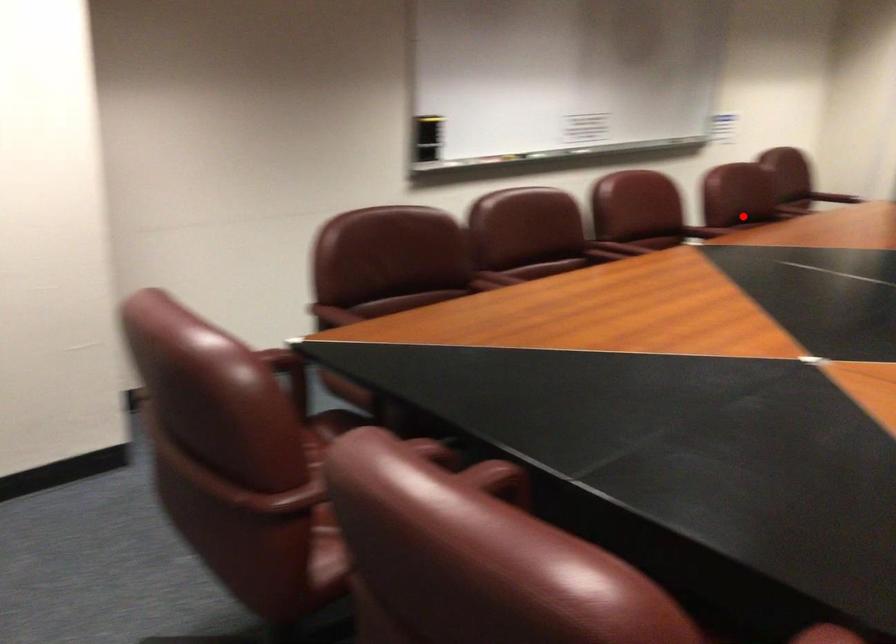
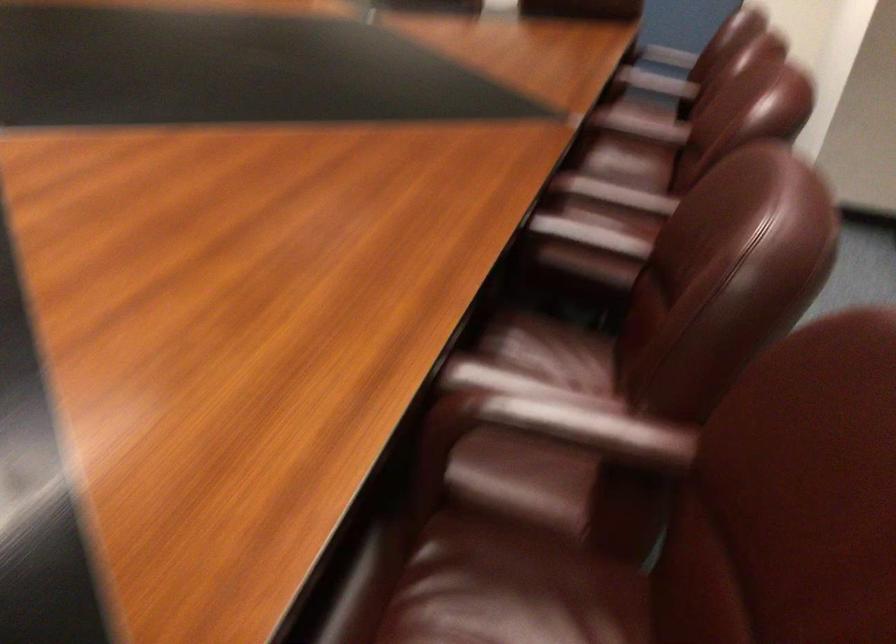
Question: I am providing you with two images of the same scene from different viewpoints. In image1, a red point is highlighted. Considering the same 3D point in image2, which of the following is correct?

Choices:
 (A) It is closer
 (B) It is farther

Answer: (A)